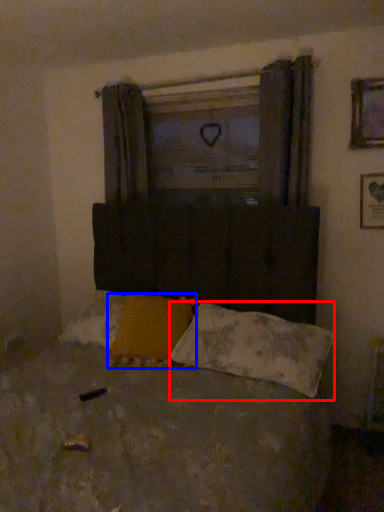
Question: Among these objects, which one is farthest to the camera, pillow (highlighted by a red box) or pillow (highlighted by a blue box)?

Choices:
 (A) pillow
 (B) pillow

Answer: (B)